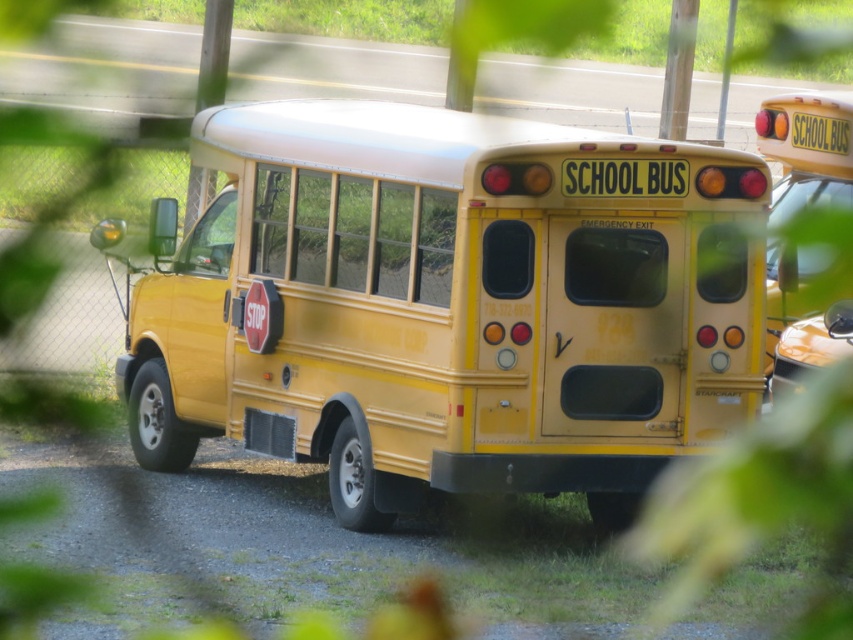
Question: Which of the following is the farthest from the observer?

Choices:
 (A) yellow matte school bus at right
 (B) yellow matte school bus at center

Answer: (A)

Question: Which point appears farthest from the camera in this image?

Choices:
 (A) 653,268
 (B) 809,180

Answer: (B)

Question: Among these objects, which one is nearest to the camera?

Choices:
 (A) yellow matte school bus at center
 (B) yellow matte school bus at right

Answer: (A)

Question: Does yellow matte school bus at center have a smaller size compared to yellow matte school bus at right?

Choices:
 (A) no
 (B) yes

Answer: (A)

Question: Where is yellow matte school bus at center located in relation to yellow matte school bus at right in the image?

Choices:
 (A) right
 (B) left

Answer: (B)

Question: Does yellow matte school bus at center have a smaller size compared to yellow matte school bus at right?

Choices:
 (A) no
 (B) yes

Answer: (A)